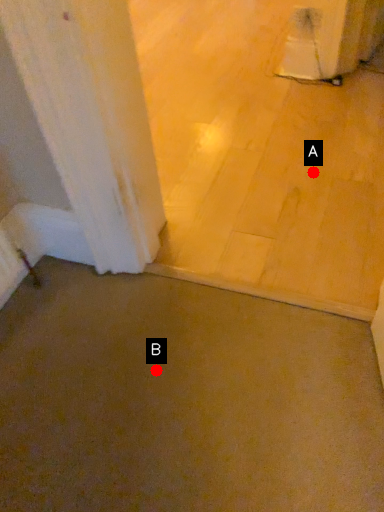
Question: Two points are circled on the image, labeled by A and B beside each circle. Which point is closer to the camera?

Choices:
 (A) A is closer
 (B) B is closer

Answer: (B)